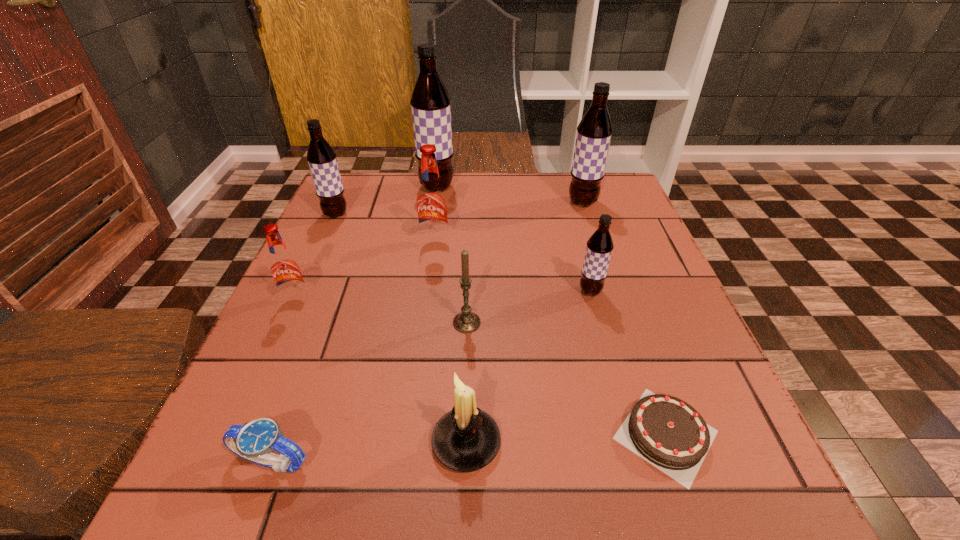
I want to click on watch at the left edge, so click(254, 441).

The width and height of the screenshot is (960, 540). Find the location of `chocolate cake located in the right edge section of the desktop`. chocolate cake located in the right edge section of the desktop is located at coordinates (667, 432).

The image size is (960, 540). I want to click on object that is at the far left corner, so click(321, 157).

The height and width of the screenshot is (540, 960). Identify the location of object located in the near left corner section of the desktop. (254, 441).

Locate an element on the screen. The image size is (960, 540). object that is positioned at the far right corner is located at coordinates (594, 131).

Identify the location of object that is at the near right corner. (667, 432).

In order to click on free location at the far edge in this screenshot , I will do `click(554, 181)`.

Where is `free region at the near edge of the desktop`? The width and height of the screenshot is (960, 540). free region at the near edge of the desktop is located at coordinates 318,501.

In the image, there is a desktop. Find the location of `free region at the left edge`. free region at the left edge is located at coordinates (335, 327).

Locate an element on the screen. The width and height of the screenshot is (960, 540). vacant area at the near left corner is located at coordinates (284, 487).